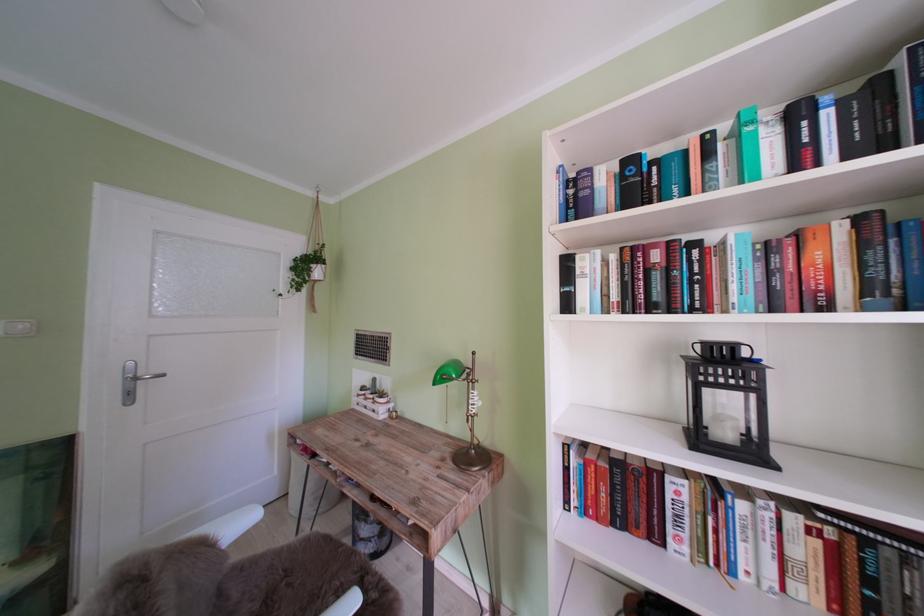
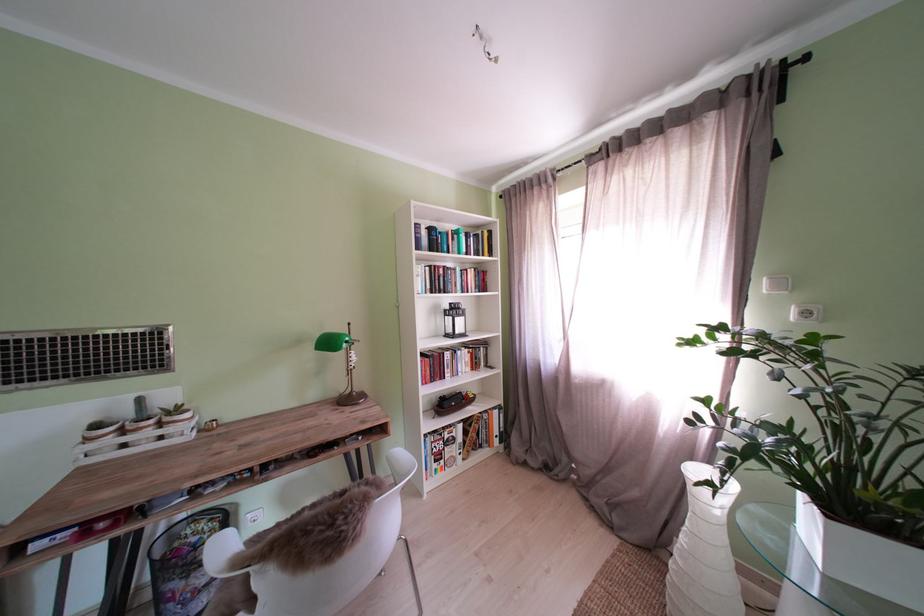
The point at (669, 544) is marked in the first image. Where is the corresponding point in the second image?

(454, 382)